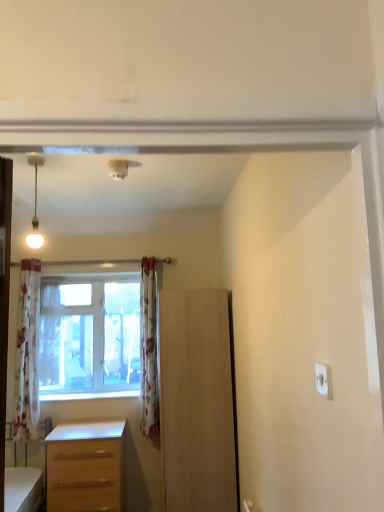
Identify the location of white glossy window sill at center. Image resolution: width=384 pixels, height=512 pixels. (88, 394).

What do you see at coordinates (148, 347) in the screenshot? The height and width of the screenshot is (512, 384). I see `floral fabric curtain at center, the third curtain in the left-to-right sequence` at bounding box center [148, 347].

Where is `floral fabric curtain at left, positioned as the third curtain in right-to-left order`? floral fabric curtain at left, positioned as the third curtain in right-to-left order is located at coordinates (27, 354).

Considering the sizes of objects clear glass window at center and light brown wood cabinet at center in the image provided, who is wider, clear glass window at center or light brown wood cabinet at center?

light brown wood cabinet at center is wider.

Is light brown wood cabinet at center inside clear glass window at center?

No, light brown wood cabinet at center is not surrounded by clear glass window at center.

Is point (44, 337) closer or farther from the camera than point (183, 453)?

Point (44, 337).

Is clear glass window at center oriented towards floral fabric curtain at center, positioned as the first curtain in right-to-left order?

Yes, clear glass window at center faces towards floral fabric curtain at center, positioned as the first curtain in right-to-left order.

Does clear glass window at center appear on the right side of floral fabric curtain at center, positioned as the first curtain in right-to-left order?

No.

Considering the sizes of objects clear glass window at center and floral fabric curtain at center, the third curtain in the left-to-right sequence, in the image provided, who is taller, clear glass window at center or floral fabric curtain at center, the third curtain in the left-to-right sequence,?

floral fabric curtain at center, the third curtain in the left-to-right sequence.

Looking at this image, from a real-world perspective, is clear glass window at center positioned over floral fabric curtain at center, the third curtain in the left-to-right sequence, based on gravity?

Yes.

Is clear glass window at center bigger or smaller than light brown wooden desk at lower left?

Considering their sizes, clear glass window at center takes up less space than light brown wooden desk at lower left.

Between point (137, 302) and point (94, 441), which one is positioned behind?

The point (137, 302) is farther.

Does clear glass window at center have a greater width compared to light brown wooden desk at lower left?

No.

In the image, there is a white floral curtain at center, which is the 2th curtain from left to right. Where is `electric outlet below it (from a real-world perspective)`? electric outlet below it (from a real-world perspective) is located at coordinates (322, 379).

Is white floral curtain at center, which is the 2th curtain from left to right, not close to white plastic electric outlet at upper right?

Absolutely, white floral curtain at center, which is the 2th curtain from left to right, is distant from white plastic electric outlet at upper right.

Is white floral curtain at center, the second curtain from the right, taller or shorter than white plastic electric outlet at upper right?

Considering their sizes, white floral curtain at center, the second curtain from the right, has more height than white plastic electric outlet at upper right.

Considering the positions of objects white floral curtain at center, which is the 2th curtain from left to right, and white plastic electric outlet at upper right in the image provided, who is behind, white floral curtain at center, which is the 2th curtain from left to right, or white plastic electric outlet at upper right?

white floral curtain at center, which is the 2th curtain from left to right.

From the picture: Would you say light brown wooden desk at lower left is a long distance from clear glass window at center?

No, light brown wooden desk at lower left is in close proximity to clear glass window at center.

Do you think light brown wooden desk at lower left is within clear glass window at center, or outside of it?

light brown wooden desk at lower left is located beyond the bounds of clear glass window at center.

Which object is positioned more to the right, light brown wooden desk at lower left or clear glass window at center?

light brown wooden desk at lower left is more to the right.

How many degrees apart are the facing directions of light brown wooden desk at lower left and clear glass window at center?

There is a 0.0899-degree angle between the facing directions of light brown wooden desk at lower left and clear glass window at center.

From the image's perspective, between floral fabric curtain at center, the third curtain in the left-to-right sequence, and clear glass window at center, who is located below?

From the image's view, floral fabric curtain at center, the third curtain in the left-to-right sequence, is below.

Is floral fabric curtain at center, positioned as the first curtain in right-to-left order, in contact with clear glass window at center?

No, floral fabric curtain at center, positioned as the first curtain in right-to-left order, is not next to clear glass window at center.

Choose the correct answer: Is floral fabric curtain at center, positioned as the first curtain in right-to-left order, inside clear glass window at center or outside it?

The correct answer is: outside.

Is point (140, 348) positioned before point (47, 377)?

Yes, it is.

Considering the sizes of objects white plastic electric outlet at upper right and floral fabric curtain at left, the 1th curtain when ordered from left to right, in the image provided, who is thinner, white plastic electric outlet at upper right or floral fabric curtain at left, the 1th curtain when ordered from left to right,?

With smaller width is white plastic electric outlet at upper right.

From the picture: Is floral fabric curtain at left, positioned as the third curtain in right-to-left order, a part of white plastic electric outlet at upper right?

No, floral fabric curtain at left, positioned as the third curtain in right-to-left order, is located outside of white plastic electric outlet at upper right.

Is point (321, 387) less distant than point (33, 330)?

Yes, it is.

The height and width of the screenshot is (512, 384). I want to click on cabinetry in front of the clear glass window at center, so click(197, 401).

There is a clear glass window at center. Identify the location of the 2nd curtain below it (from the image's perspective). The width and height of the screenshot is (384, 512). (148, 347).

From the image, which object appears to be farther from clear glass window at center, white floral curtain at center, the second curtain from the right, or matte white bulb at upper left?

matte white bulb at upper left is positioned further to the anchor clear glass window at center.

From the image, which object appears to be nearer to white plastic electric outlet at upper right, white floral curtain at center, the second curtain from the right, or white glossy window sill at center?

white glossy window sill at center lies closer to white plastic electric outlet at upper right than the other object.

Based on their spatial positions, is light brown wood cabinet at center or floral fabric curtain at left, the 1th curtain when ordered from left to right, further from clear glass window at center?

The object further to clear glass window at center is light brown wood cabinet at center.

Considering their positions, is matte white bulb at upper left positioned closer to white glossy window sill at center than floral fabric curtain at center, the third curtain in the left-to-right sequence?

floral fabric curtain at center, the third curtain in the left-to-right sequence, is closer to white glossy window sill at center.

Estimate the real-world distances between objects in this image. Which object is further from matte white bulb at upper left, floral fabric curtain at center, positioned as the first curtain in right-to-left order, or light brown wood cabinet at center?

light brown wood cabinet at center lies further to matte white bulb at upper left than the other object.

Estimate the real-world distances between objects in this image. Which object is closer to floral fabric curtain at center, positioned as the first curtain in right-to-left order, floral fabric curtain at left, the 1th curtain when ordered from left to right, or white floral curtain at center, the second curtain from the right?

white floral curtain at center, the second curtain from the right, is positioned closer to the anchor floral fabric curtain at center, positioned as the first curtain in right-to-left order.

Based on their spatial positions, is light brown wooden desk at lower left or light brown wood cabinet at center closer to floral fabric curtain at left, positioned as the third curtain in right-to-left order?

light brown wooden desk at lower left is closer to floral fabric curtain at left, positioned as the third curtain in right-to-left order.

From the image, which object appears to be nearer to white floral curtain at center, which is the 2th curtain from left to right, white plastic electric outlet at upper right or clear glass window at center?

Among the two, clear glass window at center is located nearer to white floral curtain at center, which is the 2th curtain from left to right.

Locate an element on the screen. This screenshot has height=512, width=384. desk between white glossy window sill at center and light brown wood cabinet at center is located at coordinates (86, 467).

Locate an element on the screen. lamp located between white plastic electric outlet at upper right and light brown wood cabinet at center in the depth direction is located at coordinates (35, 207).

In order to click on window sill positioned between white plastic electric outlet at upper right and white floral curtain at center, the second curtain from the right, from near to far in this screenshot , I will do `click(88, 394)`.

The height and width of the screenshot is (512, 384). Identify the location of window sill located between white plastic electric outlet at upper right and clear glass window at center in the depth direction. (88, 394).